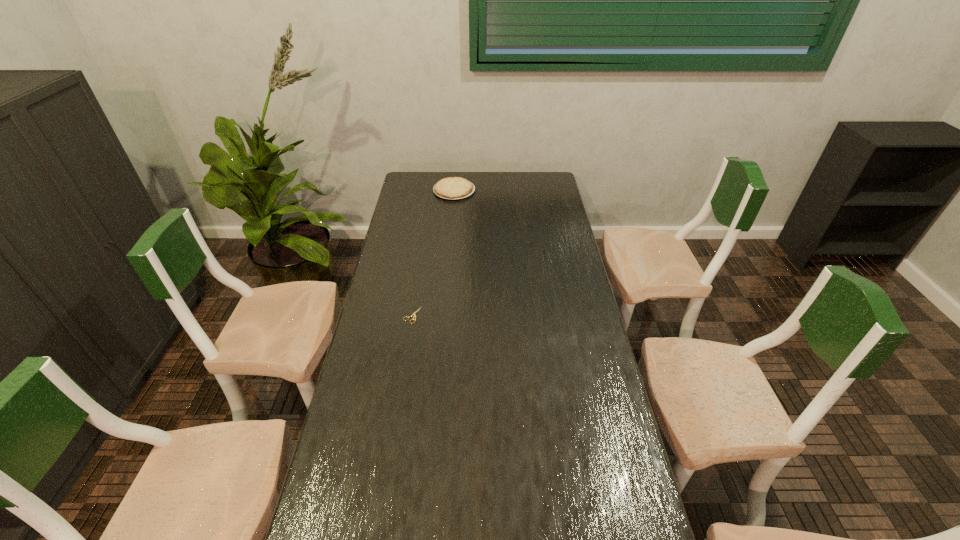
The image size is (960, 540). I want to click on free spot at the far edge of the desktop, so click(x=513, y=182).

At what (x,y) coordinates should I click in order to perform the action: click on vacant region at the left edge. Please return your answer as a coordinate pair (x, y). Image resolution: width=960 pixels, height=540 pixels. Looking at the image, I should click on (420, 210).

You are a GUI agent. You are given a task and a screenshot of the screen. Output one action in this format:
    pyautogui.click(x=<x>, y=<y>)
    Task: Click on the vacant space at the right edge of the desktop
    
    Given the screenshot: What is the action you would take?
    pyautogui.click(x=559, y=254)

Image resolution: width=960 pixels, height=540 pixels. Find the location of `vacant point located between the tortilla and the shears`. vacant point located between the tortilla and the shears is located at coordinates (433, 253).

What are the coordinates of `unoccupied position between the tortilla and the nearer object` in the screenshot? It's located at (433, 253).

Locate an element on the screen. blank region between the shears and the taller object is located at coordinates tap(433, 253).

The image size is (960, 540). Identify the location of free area in between the tortilla and the shorter object. (433, 253).

This screenshot has width=960, height=540. In order to click on vacant area that lies between the taller object and the shears in this screenshot , I will do `click(433, 253)`.

This screenshot has height=540, width=960. What are the coordinates of `empty location between the nearer object and the tortilla` in the screenshot? It's located at (433, 253).

Locate an element on the screen. This screenshot has width=960, height=540. vacant space that satisfies the following two spatial constraints: 1. on the back side of the taller object; 2. on the right side of the nearer object is located at coordinates (432, 191).